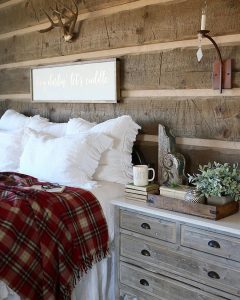
You are a GUI agent. You are given a task and a screenshot of the screen. Output one action in this format:
    pyautogui.click(x=<x>, y=<y>)
    Task: Click on the frame wooden
    The height and width of the screenshot is (300, 240).
    Given the screenshot: What is the action you would take?
    pyautogui.click(x=96, y=59)